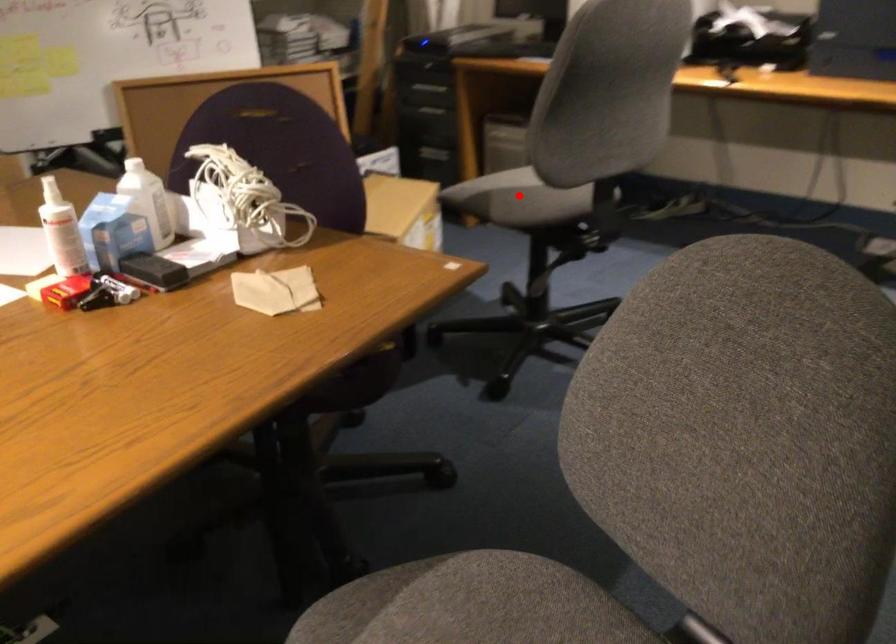
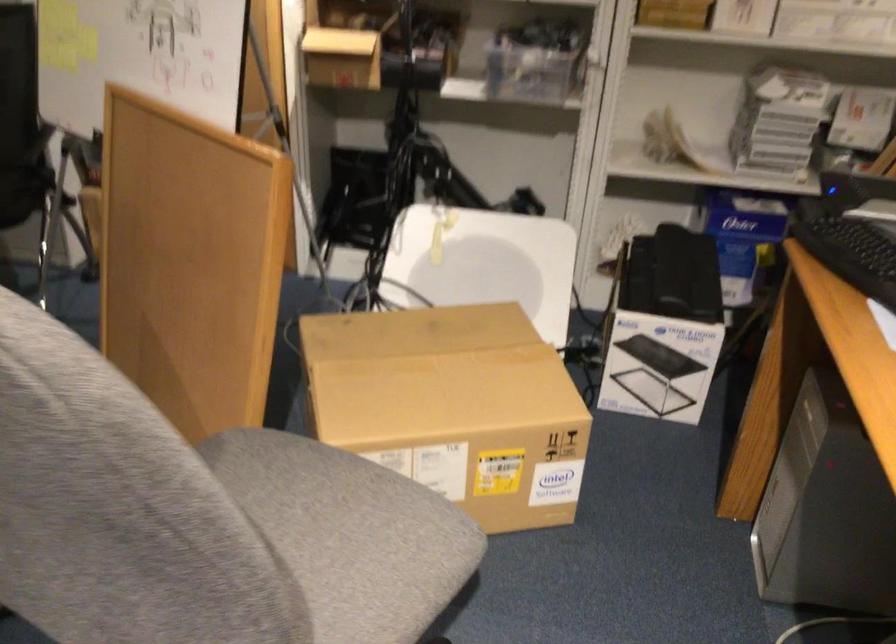
Question: I am providing you with two images of the same scene from different viewpoints. A red point is marked on the first image. Can you still see the location of the red point in image 2?

Choices:
 (A) Yes
 (B) No

Answer: (B)